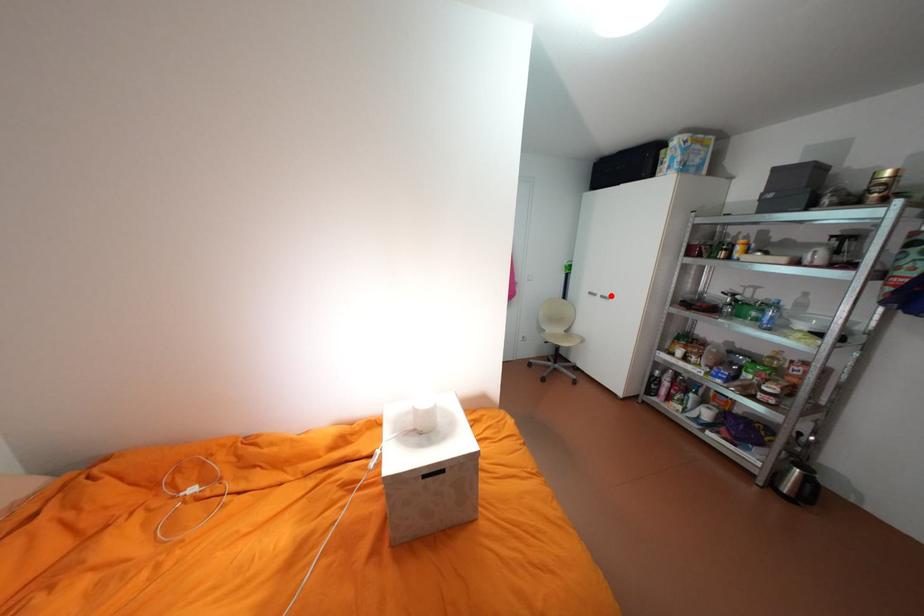
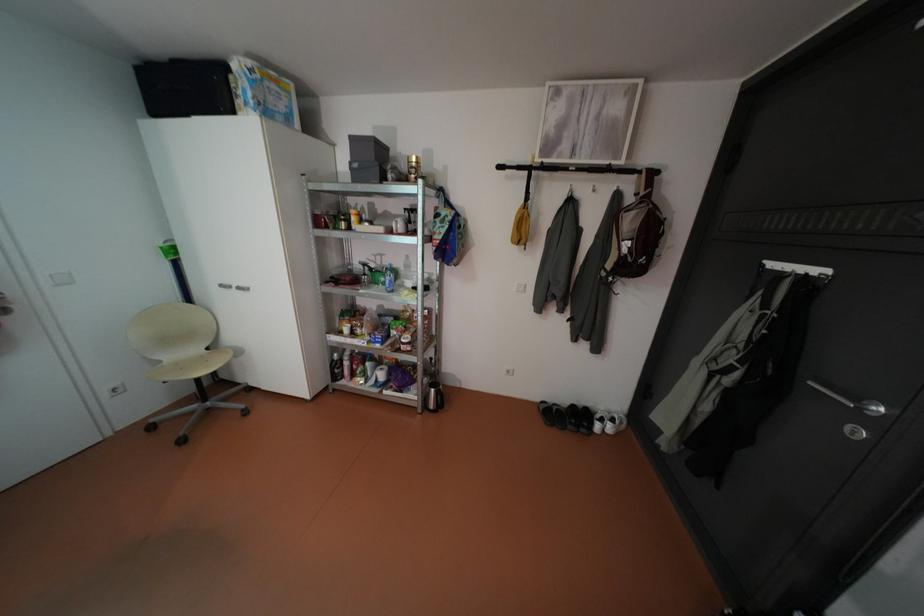
Question: I am providing you with two images of the same scene from different viewpoints. A red point is marked on the first image. Can you still see the location of the red point in image 2?

Choices:
 (A) Yes
 (B) No

Answer: (A)